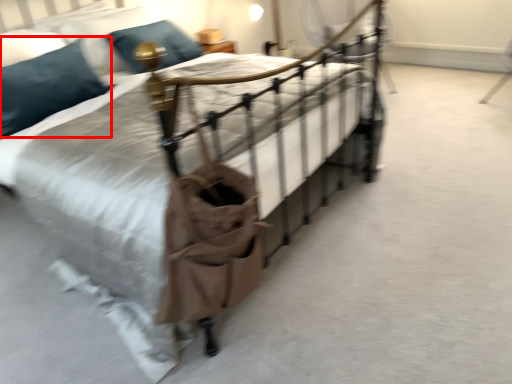
Question: From the image's perspective, what is the correct spatial relationship of pillow (annotated by the red box) in relation to pillow?

Choices:
 (A) below
 (B) above

Answer: (A)